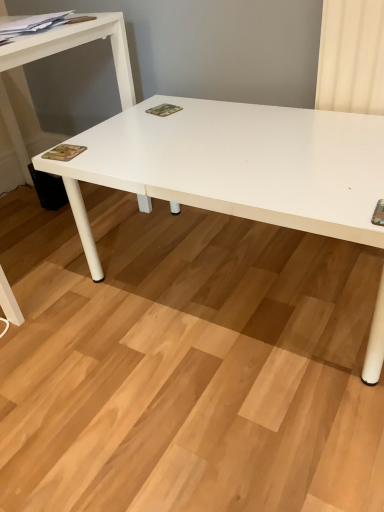
Locate an element on the screen. Image resolution: width=384 pixels, height=512 pixels. free spot in front of white matte table at left is located at coordinates (97, 362).